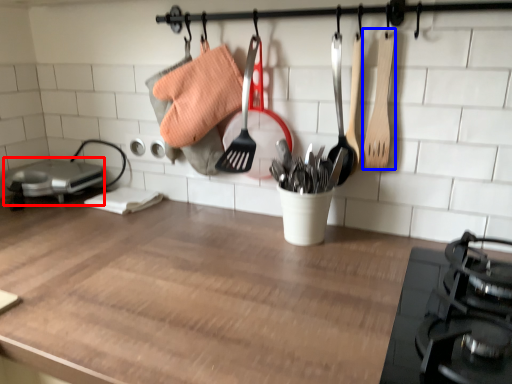
Question: Which object appears closest to the camera in this image, appliance (highlighted by a red box) or spatula (highlighted by a blue box)?

Choices:
 (A) appliance
 (B) spatula

Answer: (B)